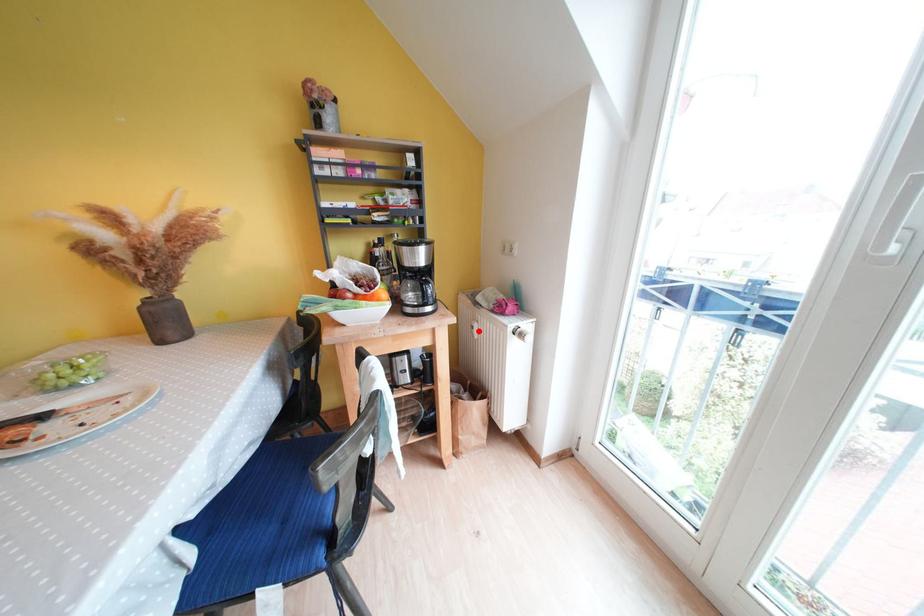
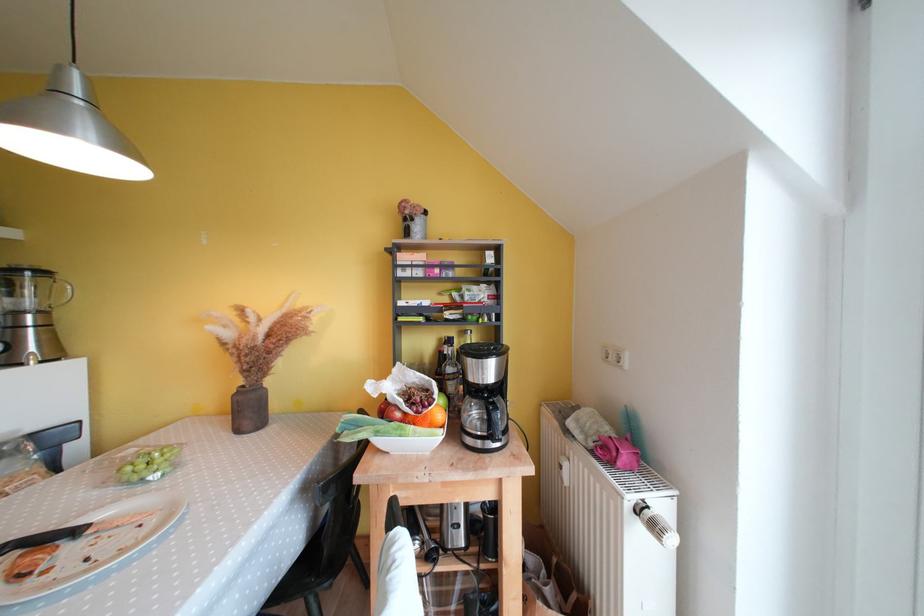
Question: I am providing you with two images of the same scene from different viewpoints. A red point is shown in image1. For the corresponding object point in image2, is it positioned nearer or farther from the camera?

Choices:
 (A) Nearer
 (B) Farther

Answer: (B)